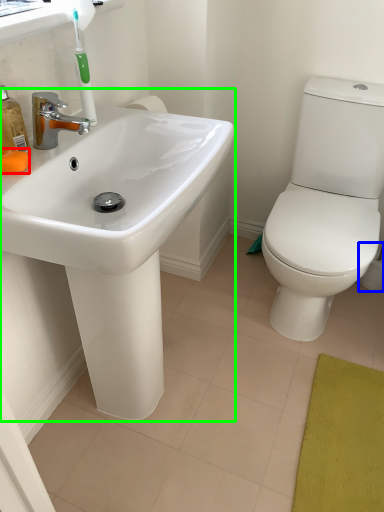
Question: Which is nearer to the soap (highlighted by a red box)? toilet paper (highlighted by a blue box) or sink (highlighted by a green box).

Choices:
 (A) toilet paper
 (B) sink

Answer: (B)